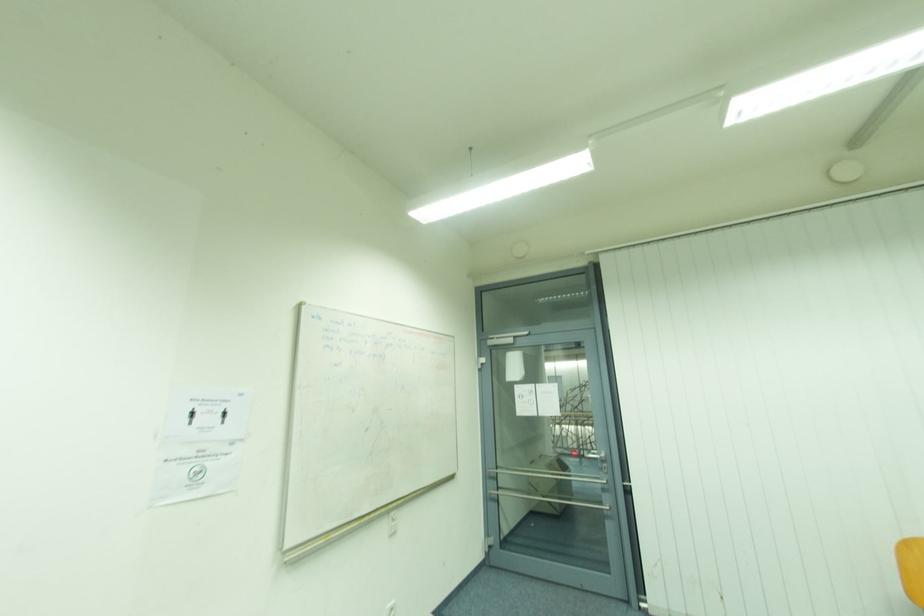
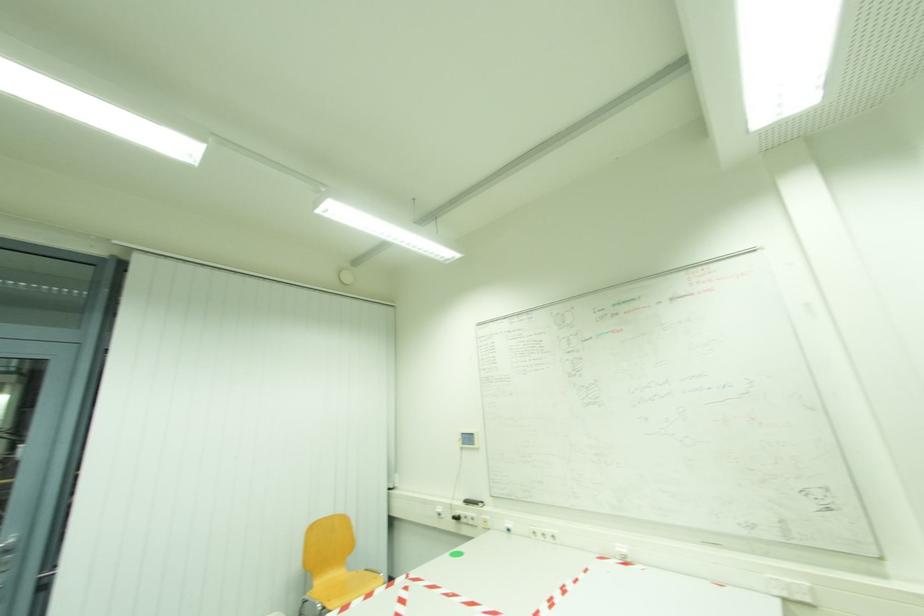
The images are taken continuously from a first-person perspective. In which direction is your viewpoint rotating?

The camera's rotation is toward right-up.